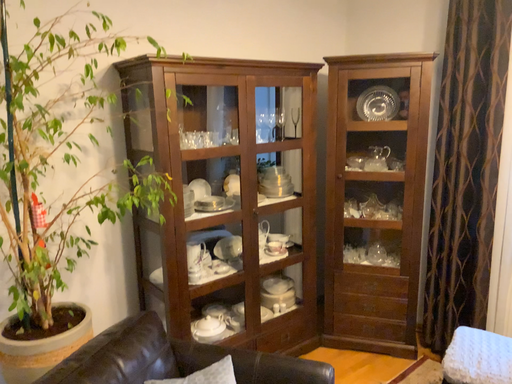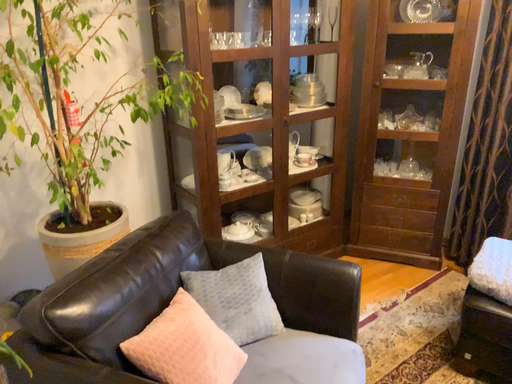
Question: How did the camera likely rotate when shooting the video?

Choices:
 (A) rotated downward
 (B) rotated upward

Answer: (A)